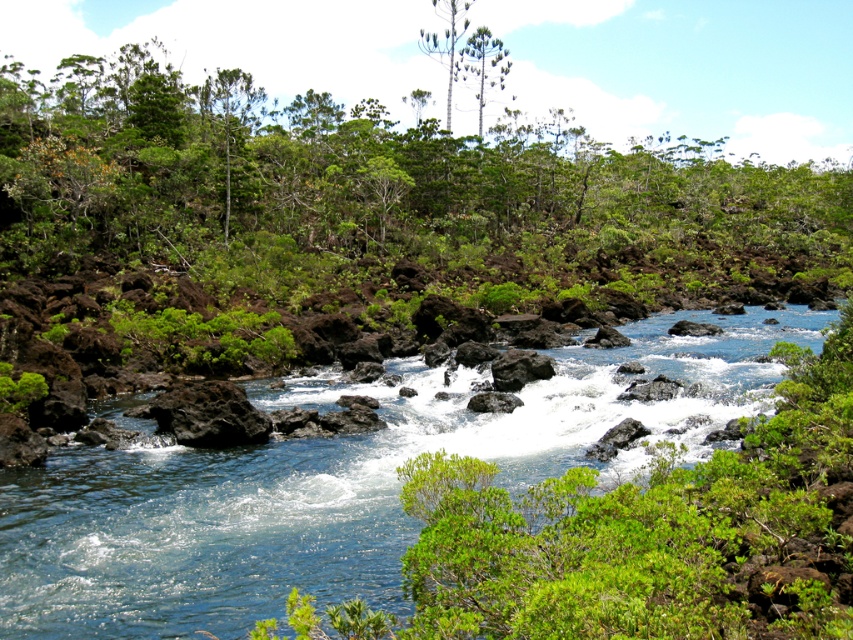
You are standing at the point with coordinates point (450, 81) and want to move towards the point with coordinates point (583, 404). Which direction should you move relative to your current position?

You should move forward because point (583, 404) is in front of point (450, 81).

You are a hiker trying to cross the river. You see the clear blue water at center and the green textured tree at upper center. Which one is closer to you?

The clear blue water at center is shorter than the green textured tree at upper center, so the clear blue water at center is closer to you.

You are standing at the origin point of the image coordinate system. Where is the clear blue water at center located in terms of its 2D coordinates?

The clear blue water at center is located at the 2D coordinates of point (16,579).